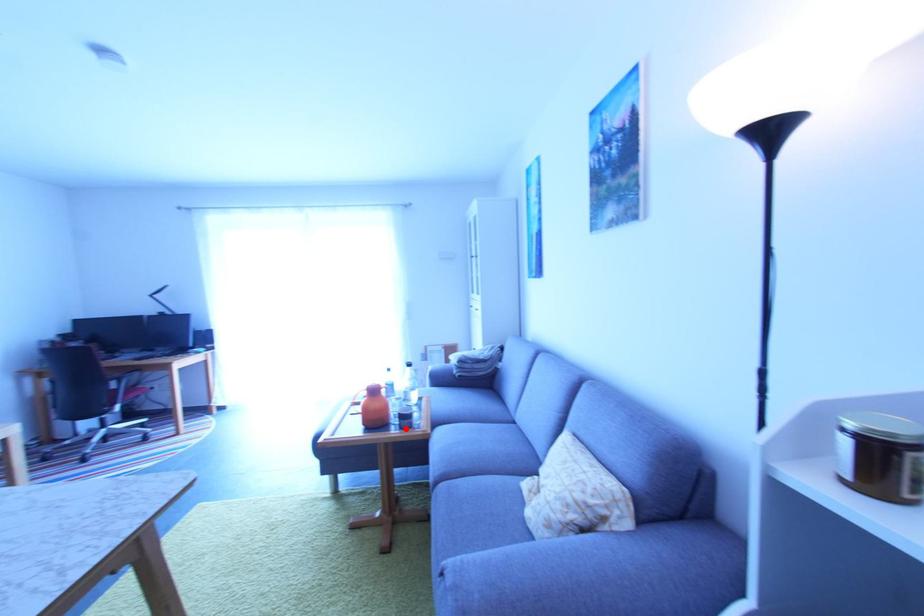
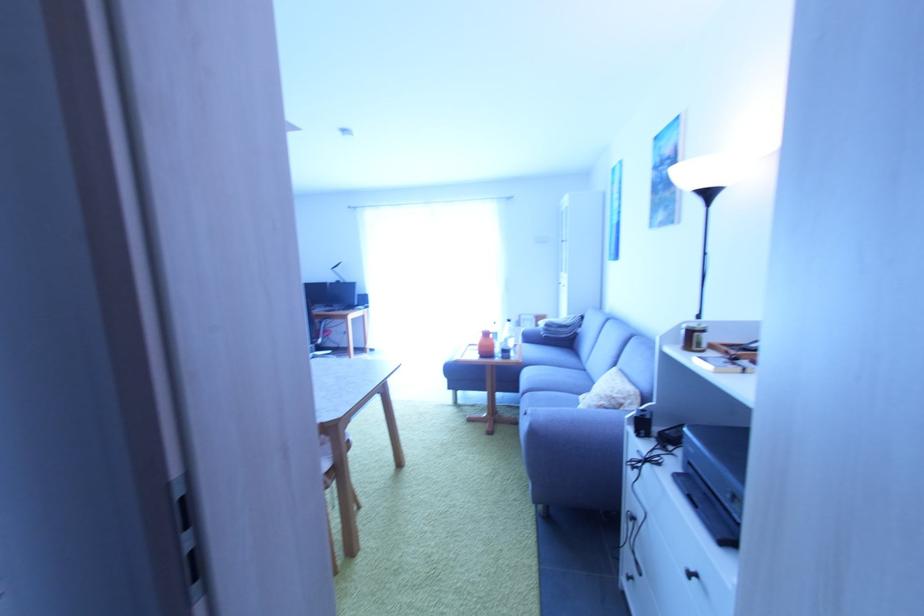
Question: I am providing you with two images of the same scene from different viewpoints. A red point is marked on the first image. Can you still see the location of the red point in image 2?

Choices:
 (A) Yes
 (B) No

Answer: (A)